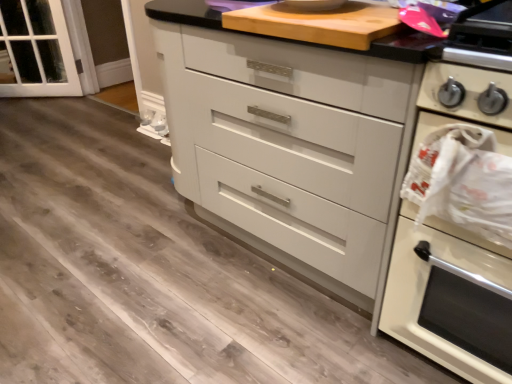
Question: Can you confirm if clear glass door at left is taller than white glossy chest of drawers at center?

Choices:
 (A) no
 (B) yes

Answer: (A)

Question: Does clear glass door at left come behind white glossy chest of drawers at center?

Choices:
 (A) yes
 (B) no

Answer: (A)

Question: Could you tell me if clear glass door at left is turned towards white glossy chest of drawers at center?

Choices:
 (A) no
 (B) yes

Answer: (A)

Question: Is clear glass door at left smaller than white glossy chest of drawers at center?

Choices:
 (A) yes
 (B) no

Answer: (A)

Question: Can you confirm if clear glass door at left is wider than white glossy chest of drawers at center?

Choices:
 (A) no
 (B) yes

Answer: (A)

Question: From a real-world perspective, is wooden cutting board at upper center above or below clear glass door at left?

Choices:
 (A) below
 (B) above

Answer: (B)

Question: In terms of height, does wooden cutting board at upper center look taller or shorter compared to clear glass door at left?

Choices:
 (A) tall
 (B) short

Answer: (B)

Question: Choose the correct answer: Is wooden cutting board at upper center inside clear glass door at left or outside it?

Choices:
 (A) outside
 (B) inside

Answer: (A)

Question: Considering their positions, is wooden cutting board at upper center located in front of or behind clear glass door at left?

Choices:
 (A) front
 (B) behind

Answer: (A)

Question: Based on their sizes in the image, would you say clear glass door at left is bigger or smaller than white glossy oven at right?

Choices:
 (A) small
 (B) big

Answer: (A)

Question: In terms of height, does clear glass door at left look taller or shorter compared to white glossy oven at right?

Choices:
 (A) tall
 (B) short

Answer: (B)

Question: From a real-world perspective, is clear glass door at left positioned above or below white glossy oven at right?

Choices:
 (A) below
 (B) above

Answer: (A)

Question: Considering the positions of point (70, 44) and point (392, 276), is point (70, 44) closer or farther from the camera than point (392, 276)?

Choices:
 (A) closer
 (B) farther

Answer: (B)

Question: Is white glossy oven at right spatially inside white glossy chest of drawers at center, or outside of it?

Choices:
 (A) outside
 (B) inside

Answer: (A)

Question: Considering the positions of white glossy oven at right and white glossy chest of drawers at center in the image, is white glossy oven at right taller or shorter than white glossy chest of drawers at center?

Choices:
 (A) short
 (B) tall

Answer: (A)